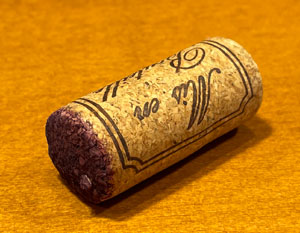
Identify the location of cork. (128, 137).